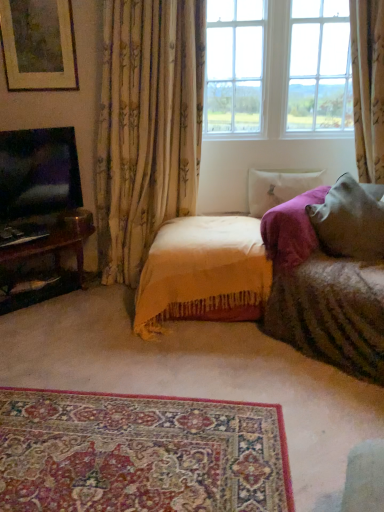
Question: Considering the relative sizes of soft gray pillow at right, placed as the 2th pillow when sorted from back to front, and white soft pillow at upper right, arranged as the 2th pillow when viewed from the front, in the image provided, is soft gray pillow at right, placed as the 2th pillow when sorted from back to front, thinner than white soft pillow at upper right, arranged as the 2th pillow when viewed from the front,?

Choices:
 (A) yes
 (B) no

Answer: (B)

Question: From the image's perspective, is soft gray pillow at right, the 1th pillow when ordered from front to back, located beneath white soft pillow at upper right, arranged as the 2th pillow when viewed from the front?

Choices:
 (A) yes
 (B) no

Answer: (A)

Question: Can you confirm if soft gray pillow at right, the 1th pillow when ordered from front to back, is smaller than white soft pillow at upper right, the 1th pillow when ordered from back to front?

Choices:
 (A) yes
 (B) no

Answer: (B)

Question: Is soft gray pillow at right, placed as the 2th pillow when sorted from back to front, at the left side of white soft pillow at upper right, arranged as the 2th pillow when viewed from the front?

Choices:
 (A) yes
 (B) no

Answer: (B)

Question: Can you confirm if soft gray pillow at right, the 1th pillow when ordered from front to back, is shorter than white soft pillow at upper right, the 1th pillow when ordered from back to front?

Choices:
 (A) yes
 (B) no

Answer: (B)

Question: Is soft gray pillow at right, the 1th pillow when ordered from front to back, facing away from white soft pillow at upper right, the 1th pillow when ordered from back to front?

Choices:
 (A) yes
 (B) no

Answer: (B)

Question: Is matte black tv at left aimed at carpet with intricate patterns at lower center?

Choices:
 (A) no
 (B) yes

Answer: (B)

Question: Does matte black tv at left have a lesser height compared to carpet with intricate patterns at lower center?

Choices:
 (A) no
 (B) yes

Answer: (A)

Question: Is matte black tv at left wider than carpet with intricate patterns at lower center?

Choices:
 (A) yes
 (B) no

Answer: (B)

Question: Is matte black tv at left to the right of carpet with intricate patterns at lower center from the viewer's perspective?

Choices:
 (A) no
 (B) yes

Answer: (A)

Question: From a real-world perspective, is matte black tv at left physically below carpet with intricate patterns at lower center?

Choices:
 (A) no
 (B) yes

Answer: (A)

Question: Does matte black tv at left come behind carpet with intricate patterns at lower center?

Choices:
 (A) no
 (B) yes

Answer: (B)

Question: Is floral fabric curtain at left aimed at matte gold picture frame at upper left?

Choices:
 (A) no
 (B) yes

Answer: (A)